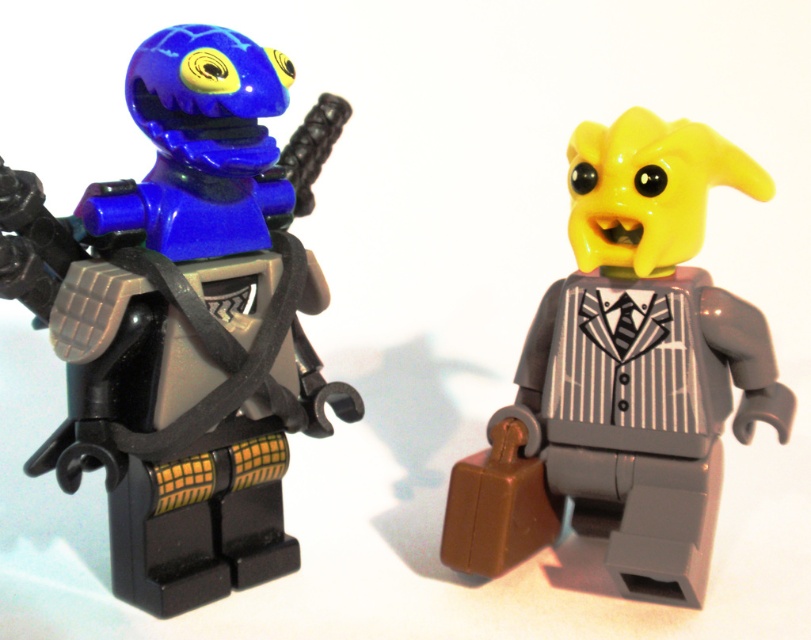
Can you confirm if shiny blue helmet at left is taller than yellow matte suit at center?

Yes.

Does shiny blue helmet at left appear over yellow matte suit at center?

Correct, shiny blue helmet at left is located above yellow matte suit at center.

Between point (39, 312) and point (620, 253), which one is positioned in front?

Point (39, 312)

Locate an element on the screen. The image size is (811, 640). shiny blue helmet at left is located at coordinates (185, 317).